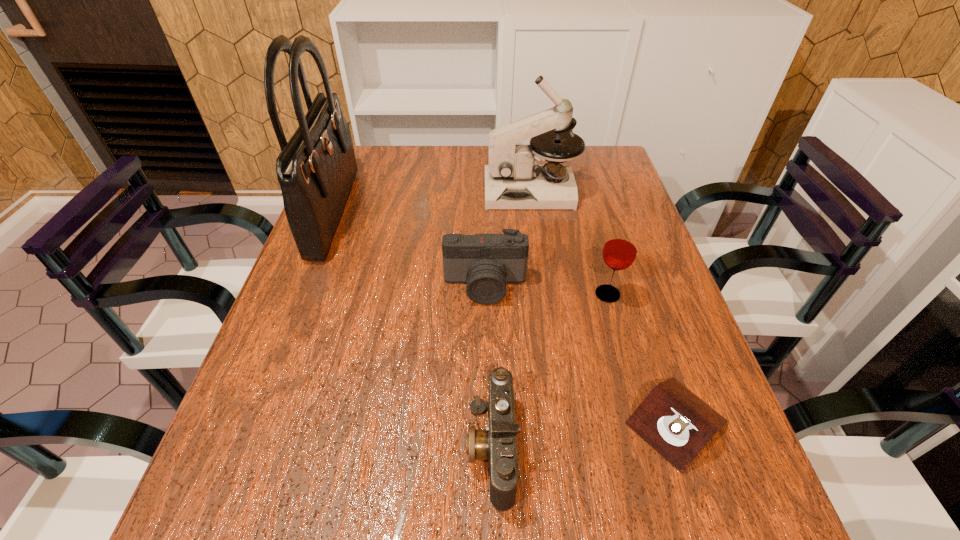
Find the location of a particular element. The height and width of the screenshot is (540, 960). microscope at the far edge is located at coordinates (514, 179).

Where is `object that is at the near edge`? The height and width of the screenshot is (540, 960). object that is at the near edge is located at coordinates (497, 443).

Find the location of a particular element. This screenshot has height=540, width=960. object that is at the left edge is located at coordinates (316, 168).

Locate an element on the screen. The height and width of the screenshot is (540, 960). microscope situated at the right edge is located at coordinates (514, 179).

Where is `glass that is at the right edge`? glass that is at the right edge is located at coordinates (620, 249).

This screenshot has height=540, width=960. Find the location of `book present at the right edge`. book present at the right edge is located at coordinates (673, 420).

At what (x,y) coordinates should I click in order to perform the action: click on object that is at the far left corner. Please return your answer as a coordinate pair (x, y). This screenshot has width=960, height=540. Looking at the image, I should click on (316, 168).

The image size is (960, 540). Find the location of `object at the far right corner`. object at the far right corner is located at coordinates (514, 179).

This screenshot has height=540, width=960. Identify the location of vacant space at the far edge of the desktop. (432, 146).

This screenshot has width=960, height=540. Identify the location of vacant space at the near edge of the desktop. (303, 532).